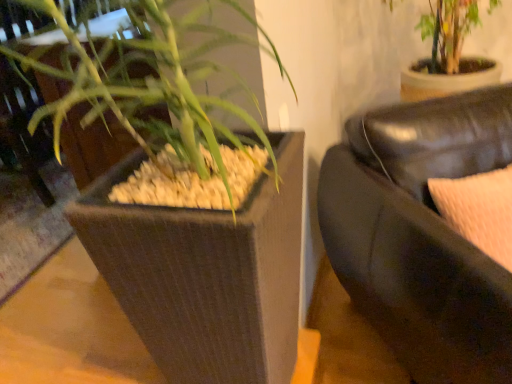
At what (x,y) coordinates should I click in order to perform the action: click on vacant space situated above brown textured planter at left (from a real-world perspective). Please return your answer as a coordinate pair (x, y). Looking at the image, I should click on (41, 255).